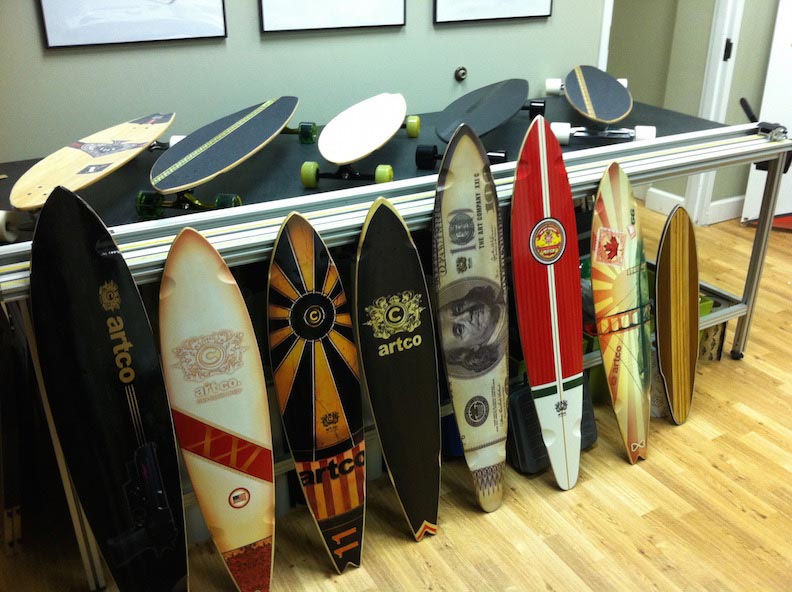
I want to click on tabletop, so click(695, 128), click(254, 173).